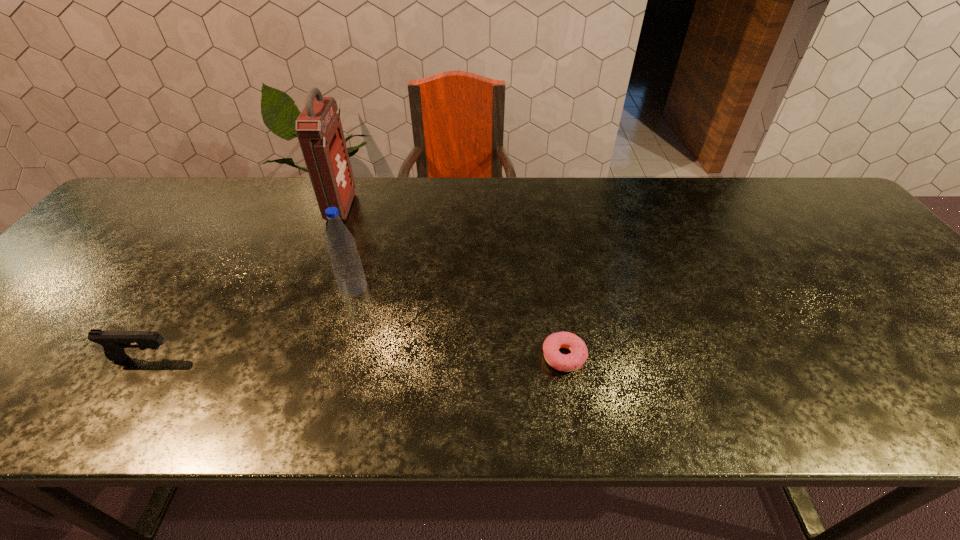
Locate an element on the screen. The image size is (960, 540). vacant position in the image that satisfies the following two spatial constraints: 1. on the front-facing side of the doughnut; 2. on the left side of the second object from left to right is located at coordinates (285, 357).

Where is `free spot that satisfies the following two spatial constraints: 1. on the back side of the rightmost object; 2. on the front-facing side of the farthest object`? The image size is (960, 540). free spot that satisfies the following two spatial constraints: 1. on the back side of the rightmost object; 2. on the front-facing side of the farthest object is located at coordinates (540, 207).

The height and width of the screenshot is (540, 960). What are the coordinates of `vacant space that satisfies the following two spatial constraints: 1. on the front-facing side of the second tallest object; 2. on the left side of the farthest object` in the screenshot? It's located at (311, 287).

Image resolution: width=960 pixels, height=540 pixels. Find the location of `vacant space that satisfies the following two spatial constraints: 1. on the front-facing side of the farthest object; 2. on the back side of the second tallest object`. vacant space that satisfies the following two spatial constraints: 1. on the front-facing side of the farthest object; 2. on the back side of the second tallest object is located at coordinates click(x=311, y=287).

At what (x,y) coordinates should I click in order to perform the action: click on vacant space that satisfies the following two spatial constraints: 1. on the front-facing side of the first-aid kit; 2. on the left side of the rightmost object. Please return your answer as a coordinate pair (x, y). Looking at the image, I should click on (285, 357).